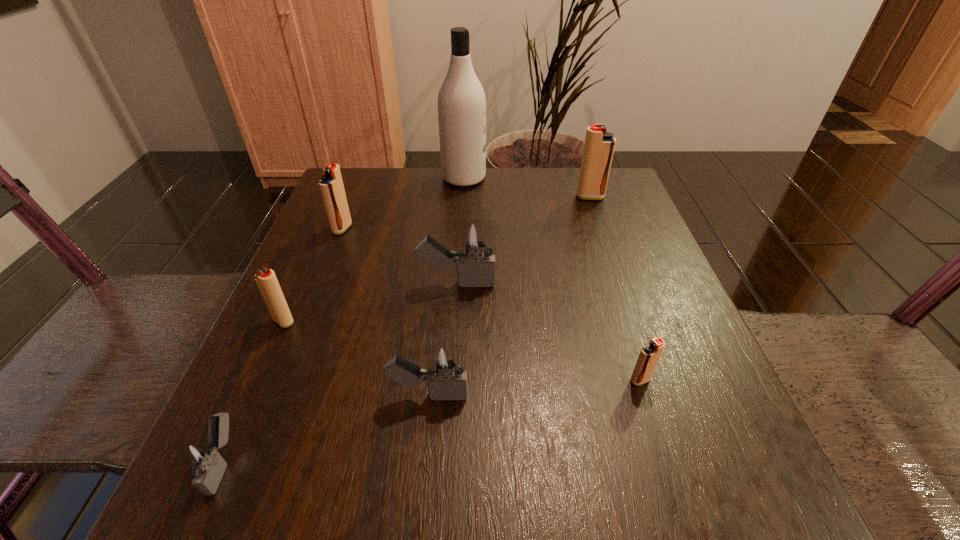
Where is `vacant space at the right edge of the desktop`? vacant space at the right edge of the desktop is located at coordinates (584, 242).

The width and height of the screenshot is (960, 540). Identify the location of free space at the far left corner of the desktop. (388, 219).

At what (x,y) coordinates should I click in order to perform the action: click on free region at the near left corner of the desktop. Please return your answer as a coordinate pair (x, y). Image resolution: width=960 pixels, height=540 pixels. Looking at the image, I should click on (314, 473).

This screenshot has width=960, height=540. In order to click on vacant area between the smallest red igniter and the tallest igniter in this screenshot , I will do `click(615, 288)`.

The width and height of the screenshot is (960, 540). I want to click on vacant space in between the second farthest gray igniter and the tallest object, so click(x=446, y=286).

The height and width of the screenshot is (540, 960). Identify the location of free spot between the nearest igniter and the farthest object. (344, 320).

Find the location of a particular element. This screenshot has width=960, height=540. free spot between the nearest red igniter and the farthest igniter is located at coordinates (615, 288).

Find the location of a particular element. vacant space in between the nearest red igniter and the second tallest object is located at coordinates (615, 288).

You are a GUI agent. You are given a task and a screenshot of the screen. Output one action in this format:
    pyautogui.click(x=<x>, y=<y>)
    Task: Click on the vacant space that's between the smallest red igniter and the tallest igniter
    Image resolution: width=960 pixels, height=540 pixels.
    Given the screenshot: What is the action you would take?
    pyautogui.click(x=615, y=288)

At what (x,y) coordinates should I click in order to perform the action: click on vacant area that lies between the second farthest gray igniter and the farthest igniter. Please return your answer as a coordinate pair (x, y). Looking at the image, I should click on (509, 296).